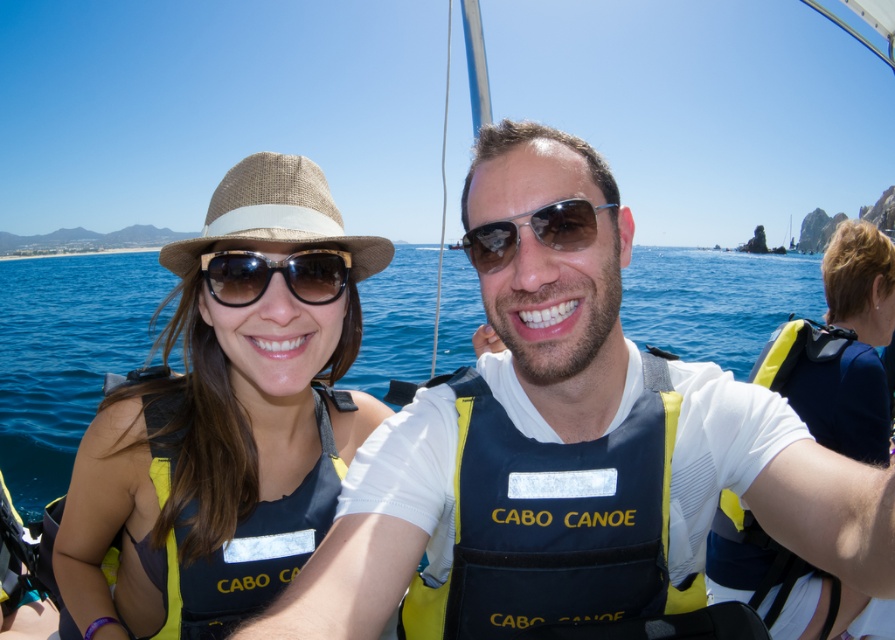
Question: Is matte black life vest at left to the left of dark blue fabric life vest at center from the viewer's perspective?

Choices:
 (A) yes
 (B) no

Answer: (A)

Question: Can you confirm if matte black life vest at left is positioned above blue water at center?

Choices:
 (A) yes
 (B) no

Answer: (B)

Question: Which object is the closest to the dark blue fabric life vest at center?

Choices:
 (A) yellow and navy blue life vest at left
 (B) matte blue life vest at center
 (C) blue water at center

Answer: (B)

Question: Which object is closer to the camera taking this photo?

Choices:
 (A) matte black life vest at left
 (B) dark blue fabric life vest at center
 (C) matte blue life vest at center

Answer: (C)

Question: Among these points, which one is nearest to the camera?

Choices:
 (A) (322, 465)
 (B) (495, 248)
 (C) (829, 529)

Answer: (C)

Question: Can you confirm if dark blue fabric life vest at center is positioned to the left of yellow and navy blue life vest at left?

Choices:
 (A) no
 (B) yes

Answer: (A)